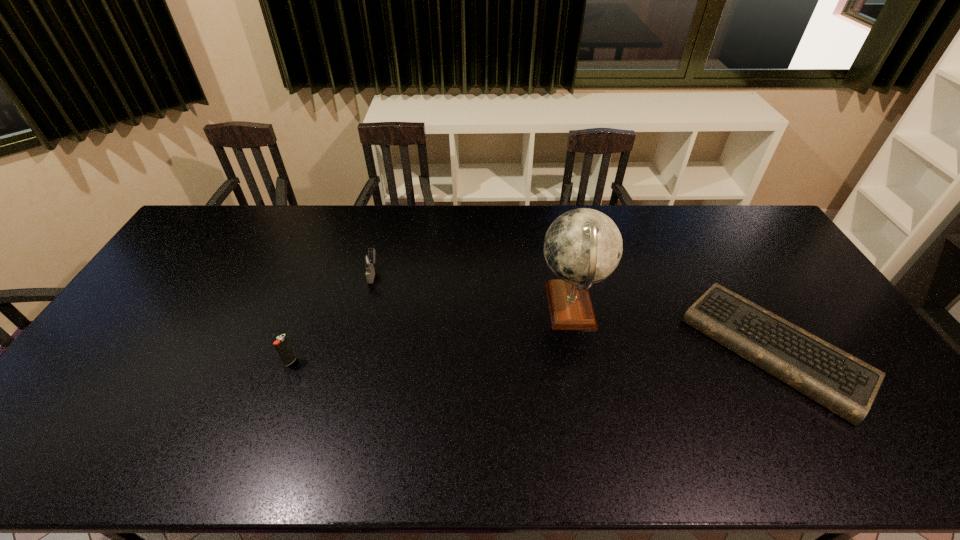
Select which object appears as the third closest to the shortest object. Please provide its 2D coordinates. Your answer should be formatted as a tuple, i.e. [(x, y)], where the tuple contains the x and y coordinates of a point satisfying the conditions above.

[(282, 345)]

You are a GUI agent. You are given a task and a screenshot of the screen. Output one action in this format:
    pyautogui.click(x=<x>, y=<y>)
    Task: Click on the blank area in the image that satisfies the following two spatial constraints: 1. at the equator of the globe; 2. on the left side of the rightmost object
    Image resolution: width=960 pixels, height=540 pixels.
    Given the screenshot: What is the action you would take?
    pyautogui.click(x=579, y=348)

Where is `vacant area in the image that satisfies the following two spatial constraints: 1. on the back side of the leftmost object; 2. on the right side of the shortest object`? The width and height of the screenshot is (960, 540). vacant area in the image that satisfies the following two spatial constraints: 1. on the back side of the leftmost object; 2. on the right side of the shortest object is located at coordinates (296, 348).

At what (x,y) coordinates should I click in order to perform the action: click on free spot that satisfies the following two spatial constraints: 1. at the equator of the tallest object; 2. on the front side of the left igniter. Please return your answer as a coordinate pair (x, y). Image resolution: width=960 pixels, height=540 pixels. Looking at the image, I should click on (582, 362).

This screenshot has width=960, height=540. What are the coordinates of `blank area in the image that satisfies the following two spatial constraints: 1. at the equator of the rightmost object; 2. on the right side of the second object from right to left` in the screenshot? It's located at (579, 348).

The image size is (960, 540). In order to click on vacant space that satisfies the following two spatial constraints: 1. at the equator of the globe; 2. on the left side of the shortest object in this screenshot , I will do `click(579, 348)`.

Locate an element on the screen. vacant space that satisfies the following two spatial constraints: 1. at the equator of the second object from right to left; 2. on the right side of the rightmost object is located at coordinates (579, 348).